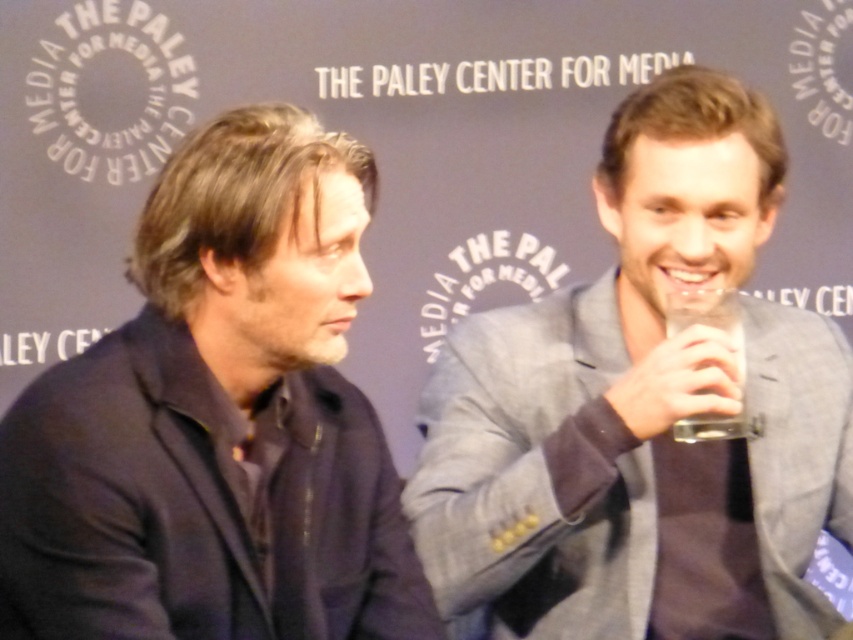
You are a photographer at the Paley Center for Media event. You need to capture a closeup shot of the gray fabric suit at right and the clear glass cup at right. What is the minimum distance you should set your camera lens to focus on to ensure both are in sharp focus?

The gray fabric suit at right is 7.09 inches from the clear glass cup at right. To ensure both are in sharp focus, the camera lens should be set to a focal distance that accommodates this separation, typically by focusing on a point midway between them or using a smaller aperture for greater depth of field.

Based on the photo, you are attending an event at The Paley Center for Media and notice two items on the right side of the stage. The gray fabric suit at right and the clear glass cup at right. From the perspective of someone sitting in the audience, which item is closer to the center of the stage?

The gray fabric suit at right is positioned on the left side of the clear glass cup at right, so from the audience perspective, the gray fabric suit at right is closer to the center of the stage than the clear glass cup at right.

You are attending a media event at The Paley Center for Media and notice two items on the table in front of you. One is the dark blue fabric at left and the other is the clear glass cup at right. Which item is nearer to you?

The dark blue fabric at left is closer to the viewer than the clear glass cup at right.